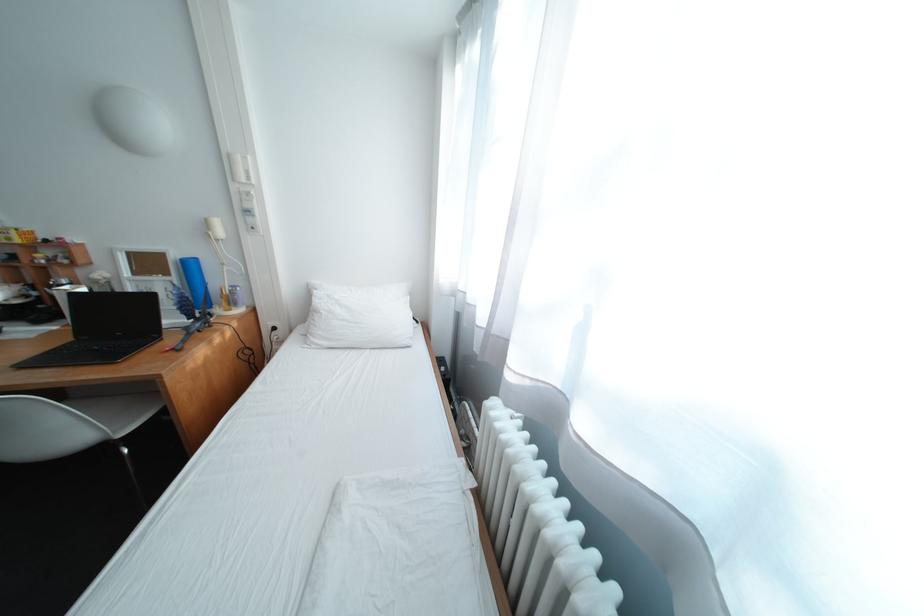
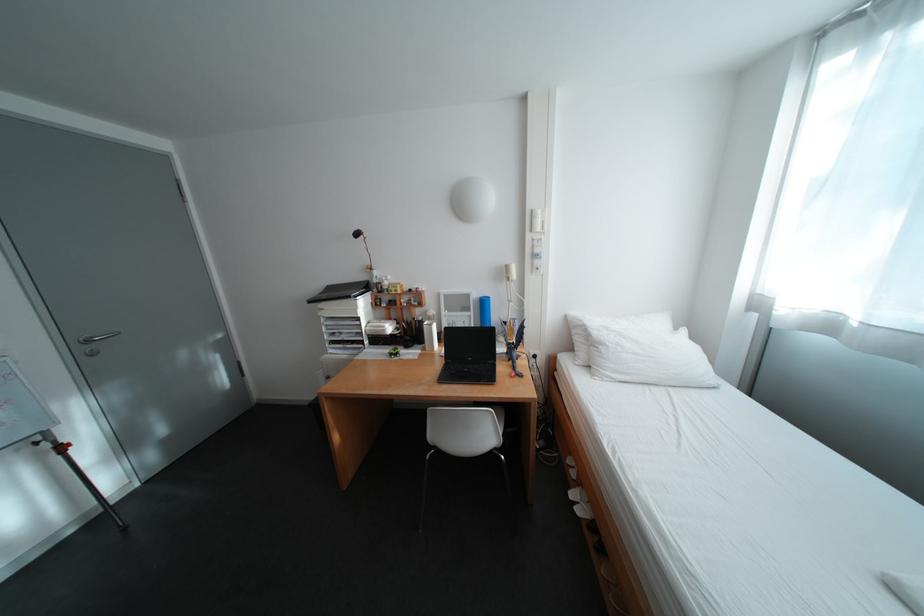
The point at (246, 188) is marked in the first image. Where is the corresponding point in the second image?

(541, 237)